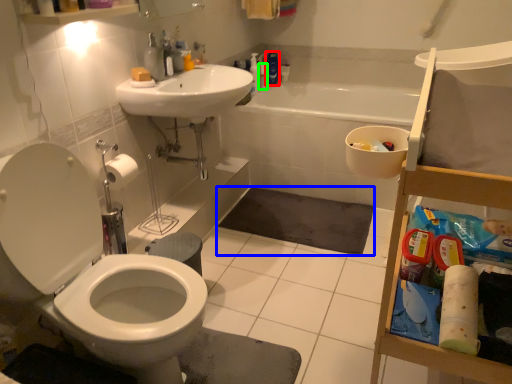
Question: Which object is the closest to the cleaning product (highlighted by a red box)? Choose among these: bath mat (highlighted by a blue box) or toiletry (highlighted by a green box).

Choices:
 (A) bath mat
 (B) toiletry

Answer: (B)